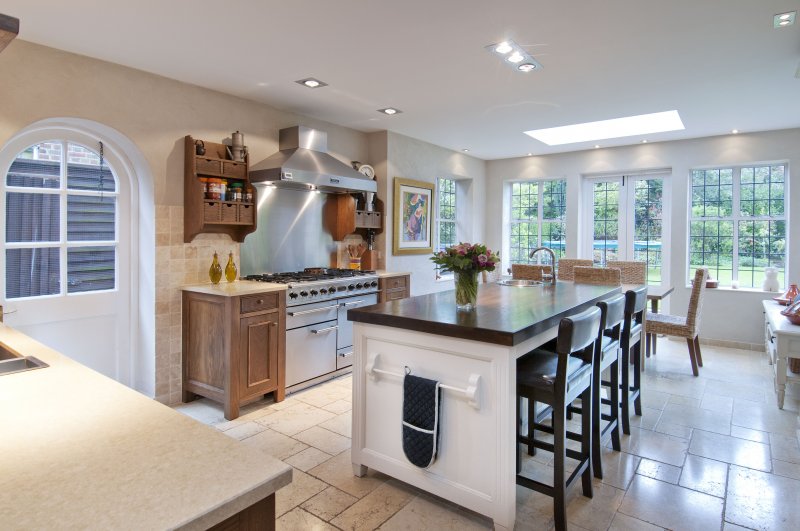
Where is `stove`? The image size is (800, 531). stove is located at coordinates (294, 273).